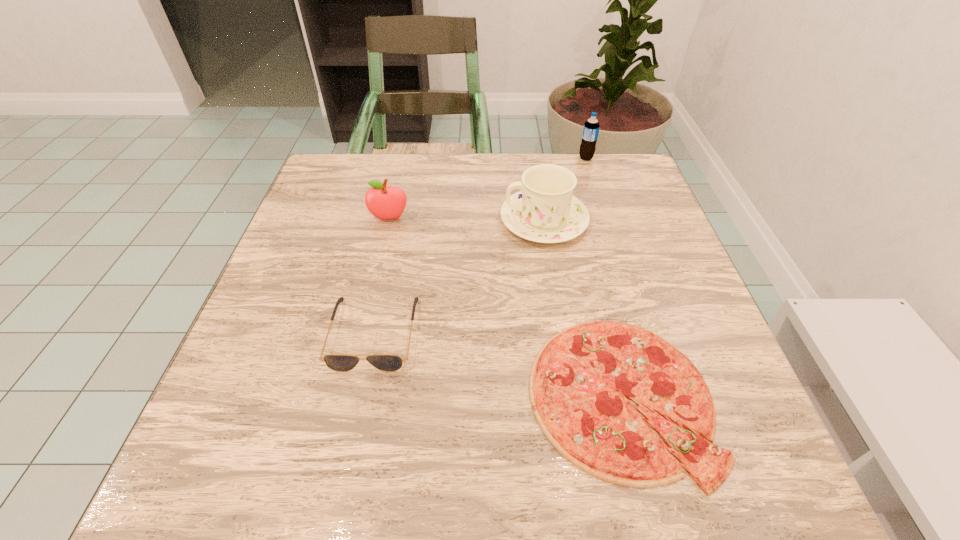
The height and width of the screenshot is (540, 960). Identify the location of object located at the near right corner. (579, 383).

Locate an element on the screen. The width and height of the screenshot is (960, 540). vacant region at the far edge of the desktop is located at coordinates (457, 164).

Locate an element on the screen. The image size is (960, 540). vacant space at the near edge is located at coordinates (351, 444).

Identify the location of free location at the left edge. This screenshot has width=960, height=540. (297, 311).

At what (x,y) coordinates should I click in order to perform the action: click on vacant space at the right edge of the desktop. Please return your answer as a coordinate pair (x, y). This screenshot has width=960, height=540. Looking at the image, I should click on (672, 248).

What are the coordinates of `vacant space at the far left corner of the desktop` in the screenshot? It's located at (328, 156).

You are a GUI agent. You are given a task and a screenshot of the screen. Output one action in this format:
    pyautogui.click(x=<x>, y=<y>)
    Task: Click on the vacant space at the far right corner of the desktop
    This screenshot has height=540, width=960.
    Given the screenshot: What is the action you would take?
    pyautogui.click(x=592, y=179)

The width and height of the screenshot is (960, 540). Identify the location of vacant area that lies between the soda bottle and the shortest object. (603, 278).

The image size is (960, 540). I want to click on vacant region between the fourth tallest object and the apple, so click(381, 276).

I want to click on free space between the apple and the soda bottle, so click(x=488, y=188).